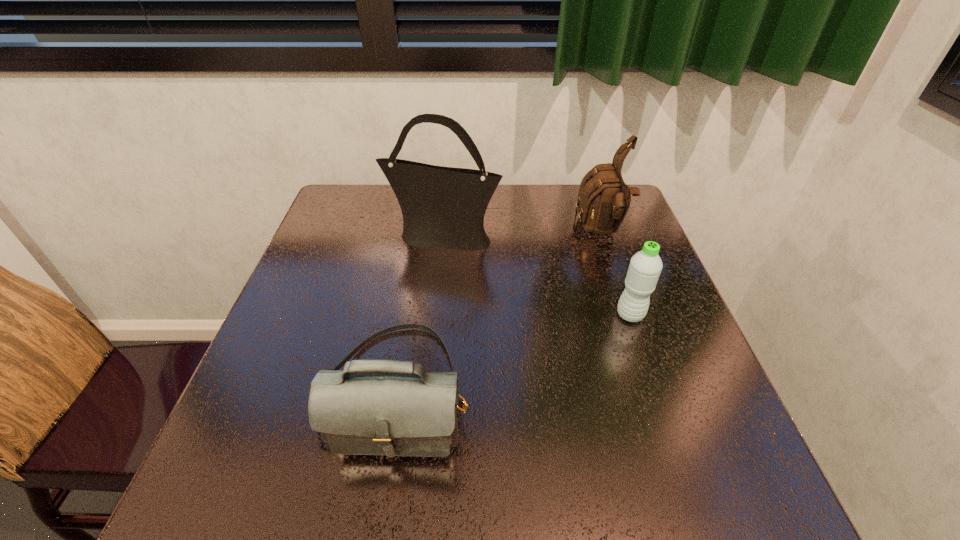
The width and height of the screenshot is (960, 540). What are the coordinates of `free space located 0.060m on the left of the second nearest object` in the screenshot? It's located at (589, 315).

Locate an element on the screen. vacant space situated on the back of the nearest object is located at coordinates (418, 271).

Image resolution: width=960 pixels, height=540 pixels. In order to click on object that is positioned at the near edge in this screenshot , I will do `click(373, 407)`.

Find the location of a particular element. The width and height of the screenshot is (960, 540). object that is positioned at the left edge is located at coordinates (373, 407).

Locate an element on the screen. The height and width of the screenshot is (540, 960). shoulder bag that is positioned at the right edge is located at coordinates (603, 200).

This screenshot has width=960, height=540. Identify the location of water bottle that is at the right edge. (645, 267).

The height and width of the screenshot is (540, 960). In order to click on object situated at the near left corner in this screenshot , I will do `click(373, 407)`.

Locate an element on the screen. The image size is (960, 540). object that is at the far right corner is located at coordinates (603, 200).

You are a GUI agent. You are given a task and a screenshot of the screen. Output one action in this format:
    pyautogui.click(x=<x>, y=<y>)
    Task: Click on the blank space at the far edge of the desktop
    The height and width of the screenshot is (540, 960).
    Given the screenshot: What is the action you would take?
    pyautogui.click(x=388, y=201)

Where is `vacant space at the near edge of the desktop`? This screenshot has height=540, width=960. vacant space at the near edge of the desktop is located at coordinates (657, 511).